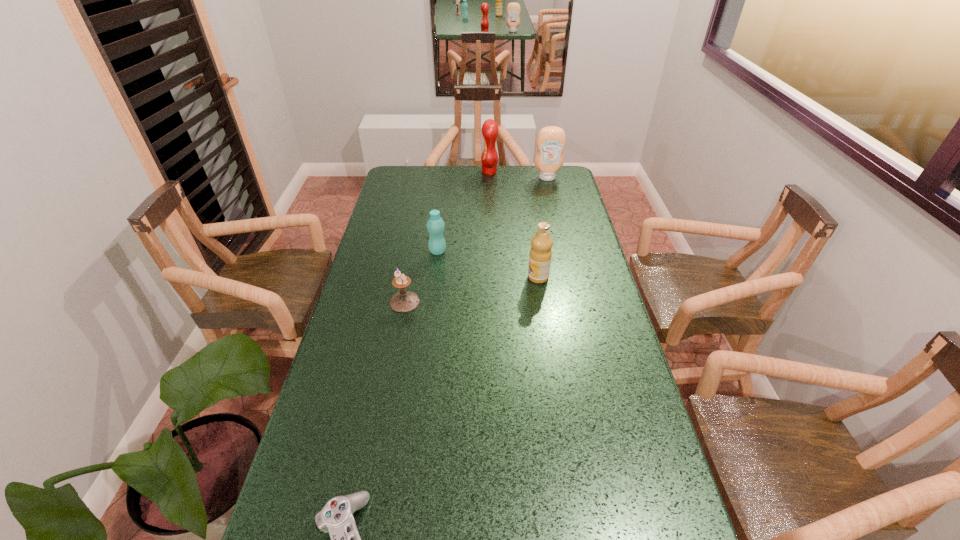
Where is `blank space located on the label of the rightmost object`? blank space located on the label of the rightmost object is located at coordinates (557, 220).

The height and width of the screenshot is (540, 960). I want to click on free space located 0.120m on the label of the olive oil, so click(492, 277).

At what (x,y) coordinates should I click in order to perform the action: click on vacant area situated on the label of the olive oil. Please return your answer as a coordinate pair (x, y). The height and width of the screenshot is (540, 960). Looking at the image, I should click on (420, 277).

I want to click on vacant space located on the label of the olive oil, so click(x=495, y=277).

Where is `free space located 0.290m on the right of the fourth nearest object`? Image resolution: width=960 pixels, height=540 pixels. free space located 0.290m on the right of the fourth nearest object is located at coordinates (524, 251).

Locate an element on the screen. This screenshot has width=960, height=540. free region located 0.110m on the front of the second nearest object is located at coordinates [397, 339].

The image size is (960, 540). What are the coordinates of `object situated at the left edge` in the screenshot? It's located at (404, 301).

This screenshot has height=540, width=960. What are the coordinates of `object located in the right edge section of the desktop` in the screenshot? It's located at (551, 140).

The width and height of the screenshot is (960, 540). I want to click on object present at the far right corner, so coord(551,140).

Find the location of `free point at the far edge`. free point at the far edge is located at coordinates (495, 184).